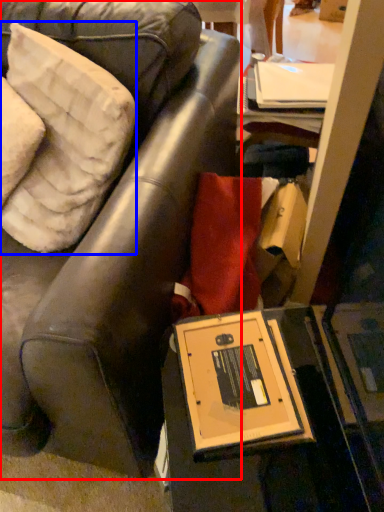
Question: Which object appears closest to the camera in this image, chair (highlighted by a red box) or pillow (highlighted by a blue box)?

Choices:
 (A) chair
 (B) pillow

Answer: (A)